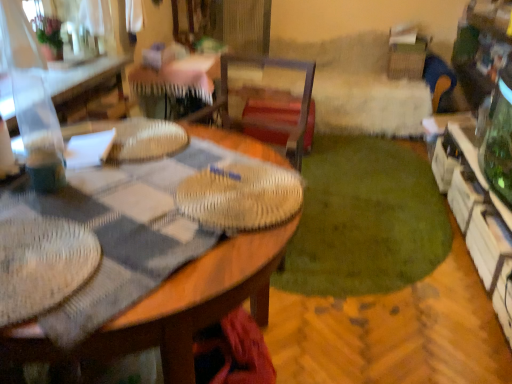
Locate an element on the screen. wooden table at upper left is located at coordinates (84, 77).

At what (x,y) coordinates should I click in order to perform the action: click on wooden table at upper left. Please return your answer as a coordinate pair (x, y). The width and height of the screenshot is (512, 384). Looking at the image, I should click on (84, 77).

Is green plush rug at center to the left of wooden table at upper left from the viewer's perspective?

In fact, green plush rug at center is to the right of wooden table at upper left.

Which object is wider, green plush rug at center or wooden table at upper left?

green plush rug at center is wider.

From a real-world perspective, between green plush rug at center and wooden table at upper left, who is vertically lower?

In real-world perspective, green plush rug at center is lower.

Is wooden table at upper left next to wooden desk at center and touching it?

They are not placed beside each other.

Relative to wooden desk at center, is wooden table at upper left in front or behind?

wooden table at upper left is behind wooden desk at center.

Which point is more forward, (63,99) or (276,239)?

The point (276,239) is closer to the camera.

From the image's perspective, which one is positioned lower, wooden table at upper left or wooden desk at center?

wooden desk at center.

Is wooden desk at center smaller than white glossy cabinet at right?

Incorrect, wooden desk at center is not smaller in size than white glossy cabinet at right.

Which of these two, wooden desk at center or white glossy cabinet at right, stands taller?

wooden desk at center.

In the image, is wooden desk at center on the left side or the right side of white glossy cabinet at right?

Based on their positions, wooden desk at center is located to the left of white glossy cabinet at right.

Is point (170, 383) more distant than point (500, 224)?

That is False.

From a real-world perspective, which object rests below the other?

green plush rug at center, from a real-world perspective.

Is green plush rug at center inside wooden desk at center?

No, wooden desk at center does not contain green plush rug at center.

Which is behind, wooden desk at center or green plush rug at center?

Positioned behind is green plush rug at center.

Is point (30, 348) in front of point (306, 173)?

That is True.

Which is nearer, (263, 240) or (61, 82)?

Positioned in front is point (263, 240).

I want to click on desk below the wooden table at upper left (from a real-world perspective), so tap(197, 301).

Looking at this image, from the image's perspective, does wooden desk at center appear higher than wooden table at upper left?

No, from the image's perspective, wooden desk at center is not on top of wooden table at upper left.

Can you confirm if wooden desk at center is bigger than wooden table at upper left?

Yes, wooden desk at center is bigger than wooden table at upper left.

Is wooden table at upper left oriented towards green plush rug at center?

No, wooden table at upper left is not aimed at green plush rug at center.

Is wooden table at upper left completely or partially outside of green plush rug at center?

Yes, wooden table at upper left is located beyond the bounds of green plush rug at center.

Is wooden table at upper left not close to green plush rug at center?

Yes, wooden table at upper left is far from green plush rug at center.

Which object is thinner, wooden table at upper left or green plush rug at center?

Thinner between the two is wooden table at upper left.

Which is farther, (459,139) or (432,208)?

The point (459,139) is farther.

Is white glossy cabinet at right inside or outside of green plush rug at center?

white glossy cabinet at right is not enclosed by green plush rug at center.

Is white glossy cabinet at right touching green plush rug at center?

No, white glossy cabinet at right is not beside green plush rug at center.

Which object is wider, white glossy cabinet at right or green plush rug at center?

With larger width is green plush rug at center.

Identify the location of table on the left of the green plush rug at center. (84, 77).

There is a wooden desk at center. Where is `table above it (from a real-world perspective)`? The image size is (512, 384). table above it (from a real-world perspective) is located at coordinates (84, 77).

Looking at the image, which one is located further to white glossy cabinet at right, wooden desk at center or wooden table at upper left?

wooden table at upper left is further to white glossy cabinet at right.

Based on their spatial positions, is white glossy cabinet at right or wooden table at upper left closer to green plush rug at center?

Based on the image, white glossy cabinet at right appears to be nearer to green plush rug at center.

Based on their spatial positions, is green plush rug at center or white glossy cabinet at right further from wooden table at upper left?

The object further to wooden table at upper left is white glossy cabinet at right.

Looking at the image, which one is located further to green plush rug at center, wooden desk at center or wooden table at upper left?

wooden table at upper left.

Considering their positions, is white glossy cabinet at right positioned closer to wooden table at upper left than wooden desk at center?

wooden desk at center lies closer to wooden table at upper left than the other object.

Looking at the image, which one is located closer to white glossy cabinet at right, wooden desk at center or green plush rug at center?

Among the two, green plush rug at center is located nearer to white glossy cabinet at right.

Estimate the real-world distances between objects in this image. Which object is closer to wooden desk at center, green plush rug at center or wooden table at upper left?

green plush rug at center.

In the scene shown: From the image, which object appears to be farther from green plush rug at center, wooden table at upper left or white glossy cabinet at right?

wooden table at upper left.

Where is `desk situated between wooden table at upper left and green plush rug at center from left to right`? The height and width of the screenshot is (384, 512). desk situated between wooden table at upper left and green plush rug at center from left to right is located at coordinates (197, 301).

The height and width of the screenshot is (384, 512). I want to click on grass situated between wooden desk at center and white glossy cabinet at right from left to right, so coord(365,220).

At what (x,y) coordinates should I click in order to perform the action: click on grass between wooden table at upper left and white glossy cabinet at right in the horizontal direction. Please return your answer as a coordinate pair (x, y). This screenshot has height=384, width=512. Looking at the image, I should click on coord(365,220).

At what (x,y) coordinates should I click in order to perform the action: click on desk situated between wooden table at upper left and white glossy cabinet at right from left to right. Please return your answer as a coordinate pair (x, y). The width and height of the screenshot is (512, 384). Looking at the image, I should click on (197, 301).